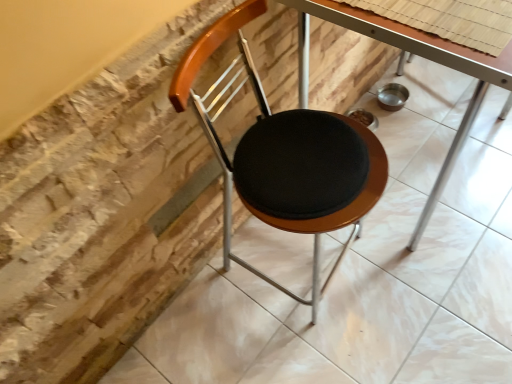
I want to click on blank area beneath matte black seat at center (from a real-world perspective), so click(308, 270).